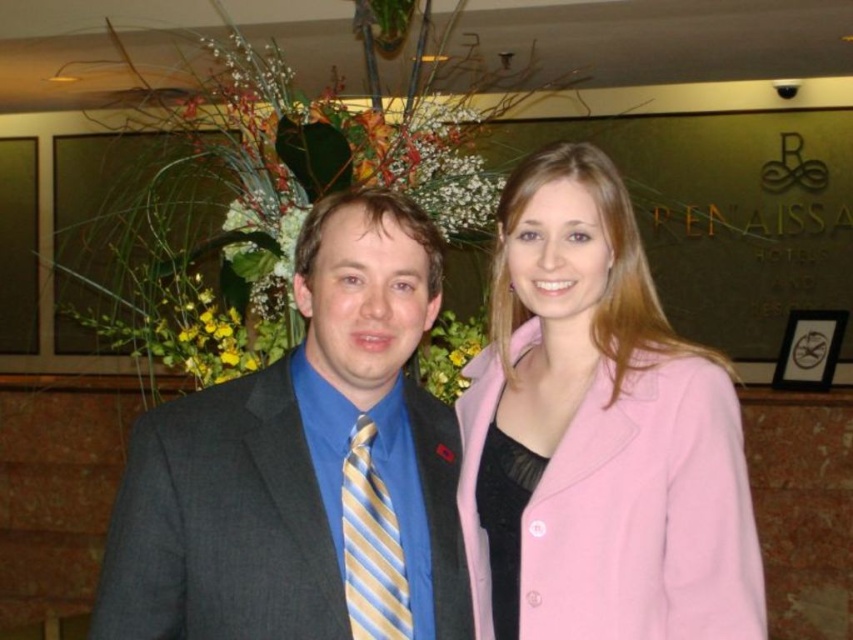
Question: Observing the image, what is the correct spatial positioning of pink woolen coat at center in reference to yellow striped tie at center?

Choices:
 (A) above
 (B) below

Answer: (A)

Question: Can you confirm if yellow striped tie at center is thinner than black satin dress at center?

Choices:
 (A) no
 (B) yes

Answer: (B)

Question: Which point is closer to the camera?

Choices:
 (A) yellow striped tie at center
 (B) pink woolen coat at center
 (C) black satin dress at center
 (D) matte gray suit at center

Answer: (D)

Question: Considering the relative positions of yellow striped tie at center and black satin dress at center in the image provided, where is yellow striped tie at center located with respect to black satin dress at center?

Choices:
 (A) left
 (B) right

Answer: (A)

Question: Which of these objects is positioned closest to the matte gray suit at center?

Choices:
 (A) pink woolen coat at center
 (B) yellow striped tie at center

Answer: (B)

Question: Which of the following is the closest to the observer?

Choices:
 (A) pink woolen coat at center
 (B) matte gray suit at center
 (C) black satin dress at center
 (D) yellow striped tie at center

Answer: (B)